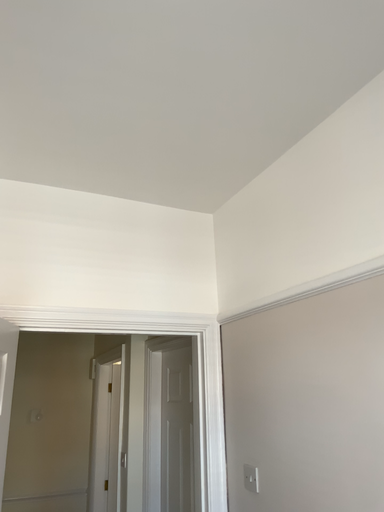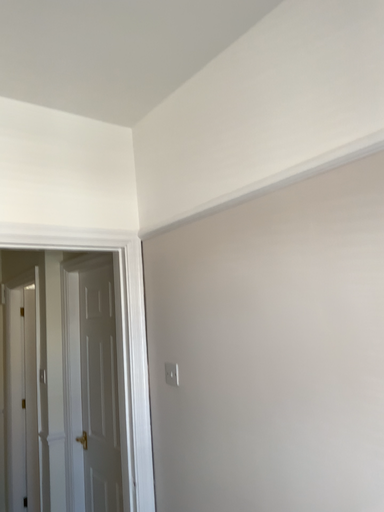
Question: Which way did the camera rotate in the video?

Choices:
 (A) rotated right
 (B) rotated left

Answer: (A)